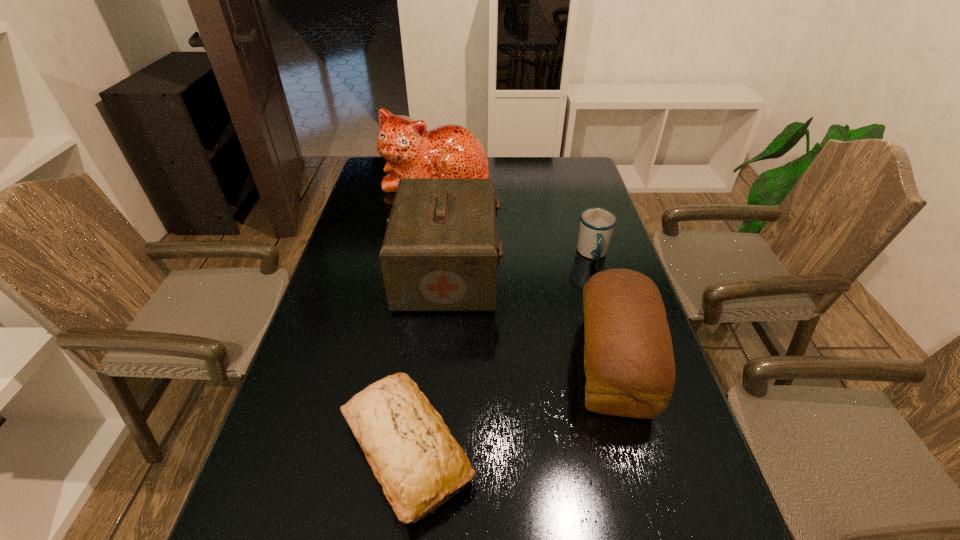
I want to click on free space that satisfies the following two spatial constraints: 1. on the face of the farthest object; 2. on the right side of the right bread, so click(409, 364).

You are a GUI agent. You are given a task and a screenshot of the screen. Output one action in this format:
    pyautogui.click(x=<x>, y=<y>)
    Task: Click on the free spot that satisfies the following two spatial constraints: 1. on the face of the third shortest object; 2. on the left side of the farthest object
    
    Given the screenshot: What is the action you would take?
    pyautogui.click(x=409, y=364)

The height and width of the screenshot is (540, 960). I want to click on vacant space that satisfies the following two spatial constraints: 1. on the face of the first-aid kit; 2. on the left side of the cat, so click(x=422, y=271).